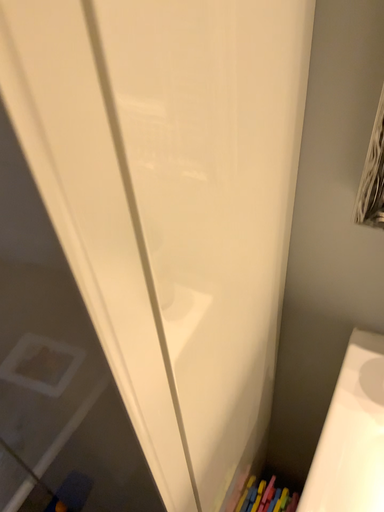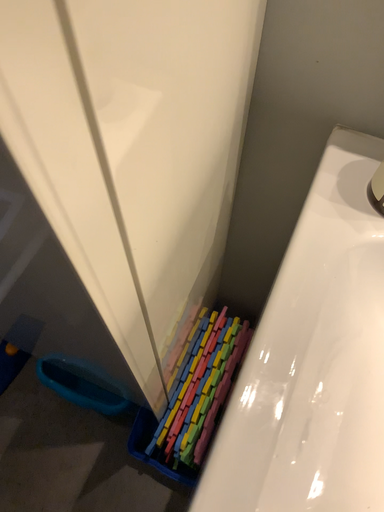
Question: Which way did the camera rotate in the video?

Choices:
 (A) rotated downward
 (B) rotated upward

Answer: (A)